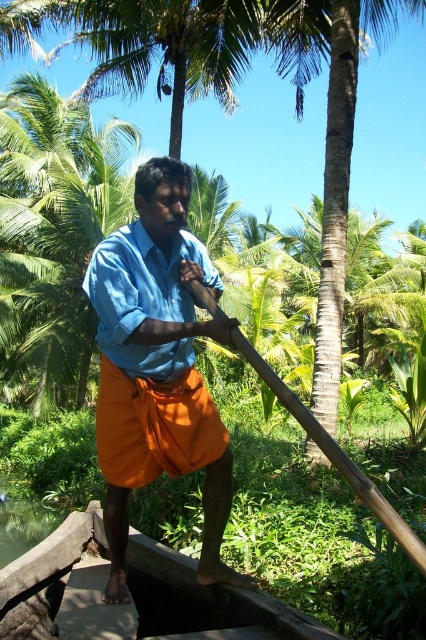
You are navigating a wooden boat and need to avoid hitting the smooth brown trunk of palm tree at center. Based on its position coordinates, can you determine if the trunk is directly ahead of the boat or to the side?

The smooth brown trunk of palm tree at center is located at point 0.223 on the x axis and 0.775 on the y axis. Since the boat is at the edge, the trunk is to the side rather than directly ahead.

You are a tourist on a boat ride in a tropical area. You notice the blue cotton shirt at center and the brown wooden paddle at center. Which object is closer to you?

The blue cotton shirt at center is closer to you because it is further to the viewer than the brown wooden paddle at center.

You are a photographer trying to capture the man in the blue cotton shirt at center. If you want to focus on the shirt, where should you aim your camera? Please provide coordinates in the format of x,y between 0 and 1.

The blue cotton shirt at center is located at coordinates (x=157, y=368), so you should aim your camera at that point.